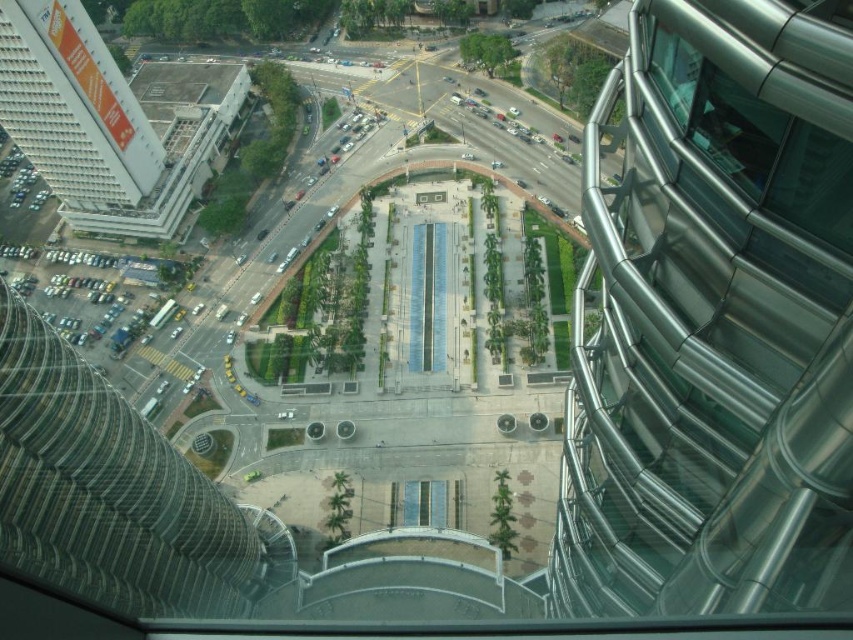
From the picture: You are an architect analyzing the structural integrity of the buildings in the scene. Given that the metallic silver tower at right has a narrower base compared to the white textured building at upper left, which one might require additional reinforcement to withstand strong winds?

The metallic silver tower at right might require additional reinforcement because it is thinner than the white textured building at upper left, making it more susceptible to wind forces.

You are standing at the center of the plaza and want to take a photo of the metallic silver tower at right. Which direction should you face to capture it in your shot?

The metallic silver tower at right is located at point (714, 321), so you should face towards the right side to capture it in your shot.

You are standing at the center of the plaza and looking towards the metallic silver tower at right and the white textured building at upper left. Which one is positioned higher in the image?

The white textured building at upper left is positioned higher in the image than the metallic silver tower at right.